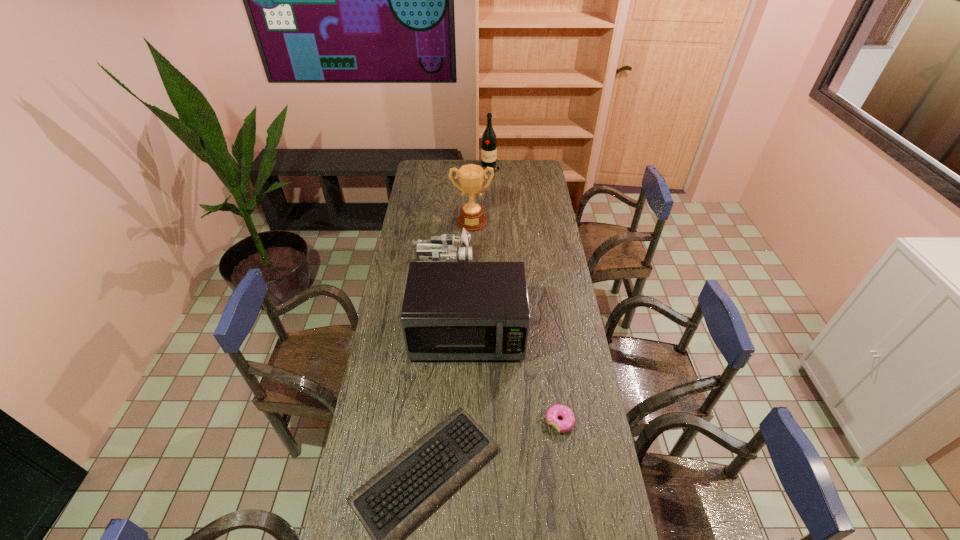
This screenshot has height=540, width=960. I want to click on vacant space at the far right corner of the desktop, so click(539, 171).

The width and height of the screenshot is (960, 540). I want to click on empty space that is in between the third nearest object and the wine bottle, so click(479, 251).

I want to click on object that is the closest one to the camcorder, so pos(471,177).

Choose which object is the fifth nearest neighbor to the farthest object. Please provide its 2D coordinates. Your answer should be formatted as a tuple, i.e. [(x, y)], where the tuple contains the x and y coordinates of a point satisfying the conditions above.

[(398, 498)]

Find the location of a particular element. vacant space that satisfies the following two spatial constraints: 1. on the surface of the wine bottle; 2. on the front-facing side of the third farthest object is located at coordinates (492, 261).

The height and width of the screenshot is (540, 960). What are the coordinates of `free space that satisfies the following two spatial constraints: 1. on the front-facing side of the doughnut; 2. on the right side of the award` in the screenshot? It's located at (468, 422).

Image resolution: width=960 pixels, height=540 pixels. What are the coordinates of `vacant area in the image that satisfies the following two spatial constraints: 1. on the front-facing side of the rightmost object; 2. on the left side of the fourth nearest object` in the screenshot? It's located at (429, 422).

You are a GUI agent. You are given a task and a screenshot of the screen. Output one action in this format:
    pyautogui.click(x=<x>, y=<y>)
    Task: Click on the vacant space that satisfies the following two spatial constraints: 1. on the front-facing side of the fifth nearest object; 2. on the front-facing side of the third shortest object
    This screenshot has width=960, height=540.
    Given the screenshot: What is the action you would take?
    tap(471, 261)

Where is `vacant space that satisfies the following two spatial constraints: 1. on the front-facing side of the doughnut; 2. on the right side of the camcorder`? The height and width of the screenshot is (540, 960). vacant space that satisfies the following two spatial constraints: 1. on the front-facing side of the doughnut; 2. on the right side of the camcorder is located at coordinates (429, 422).

Where is `vacant area in the image that satisfies the following two spatial constraints: 1. on the front-facing side of the second farthest object; 2. on the front-facing side of the camcorder`? The image size is (960, 540). vacant area in the image that satisfies the following two spatial constraints: 1. on the front-facing side of the second farthest object; 2. on the front-facing side of the camcorder is located at coordinates (471, 261).